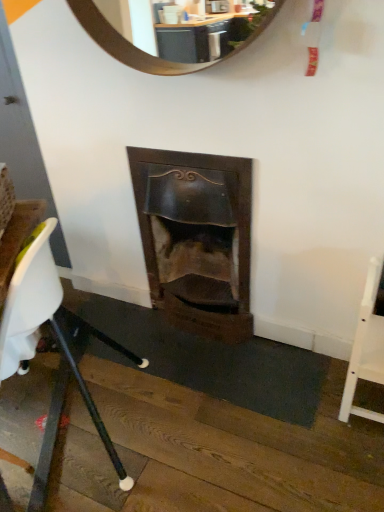
Question: Considering the relative positions of white plastic chair at lower left, which is the second chair in right-to-left order, and wooden fireplace at center in the image provided, is white plastic chair at lower left, which is the second chair in right-to-left order, behind wooden fireplace at center?

Choices:
 (A) yes
 (B) no

Answer: (B)

Question: Does white plastic chair at lower left, acting as the first chair starting from the left, have a greater width compared to wooden fireplace at center?

Choices:
 (A) no
 (B) yes

Answer: (B)

Question: From the image's perspective, is white plastic chair at lower left, which is the second chair in right-to-left order, under wooden fireplace at center?

Choices:
 (A) yes
 (B) no

Answer: (A)

Question: Is white plastic chair at lower left, which is the second chair in right-to-left order, facing away from wooden fireplace at center?

Choices:
 (A) yes
 (B) no

Answer: (B)

Question: Can you confirm if white plastic chair at lower left, acting as the first chair starting from the left, is positioned to the left of wooden fireplace at center?

Choices:
 (A) yes
 (B) no

Answer: (A)

Question: Considering the positions of white plastic chair at lower left, which is the second chair in right-to-left order, and white wood chair at right, placed as the 2th chair when sorted from left to right, in the image, is white plastic chair at lower left, which is the second chair in right-to-left order, taller or shorter than white wood chair at right, placed as the 2th chair when sorted from left to right,?

Choices:
 (A) short
 (B) tall

Answer: (B)

Question: Looking at their shapes, would you say white plastic chair at lower left, acting as the first chair starting from the left, is wider or thinner than white wood chair at right, placed as the 2th chair when sorted from left to right?

Choices:
 (A) wide
 (B) thin

Answer: (A)

Question: In the image, is white plastic chair at lower left, which is the second chair in right-to-left order, positioned in front of or behind white wood chair at right, the first chair viewed from the right?

Choices:
 (A) behind
 (B) front

Answer: (B)

Question: From a real-world perspective, is white plastic chair at lower left, which is the second chair in right-to-left order, positioned above or below white wood chair at right, placed as the 2th chair when sorted from left to right?

Choices:
 (A) below
 (B) above

Answer: (B)

Question: Relative to white wood chair at right, the first chair viewed from the right, is wooden fireplace at center in front or behind?

Choices:
 (A) behind
 (B) front

Answer: (A)

Question: In the image, is wooden fireplace at center on the left side or the right side of white wood chair at right, the first chair viewed from the right?

Choices:
 (A) left
 (B) right

Answer: (A)

Question: Which is correct: wooden fireplace at center is inside white wood chair at right, placed as the 2th chair when sorted from left to right, or outside of it?

Choices:
 (A) inside
 (B) outside

Answer: (B)

Question: From the image's perspective, is wooden fireplace at center positioned above or below white wood chair at right, placed as the 2th chair when sorted from left to right?

Choices:
 (A) below
 (B) above

Answer: (B)

Question: From the image's perspective, relative to white plastic chair at lower left, acting as the first chair starting from the left, is wooden fireplace at center above or below?

Choices:
 (A) below
 (B) above

Answer: (B)

Question: Considering the positions of wooden fireplace at center and white plastic chair at lower left, acting as the first chair starting from the left, in the image, is wooden fireplace at center taller or shorter than white plastic chair at lower left, acting as the first chair starting from the left,?

Choices:
 (A) tall
 (B) short

Answer: (B)